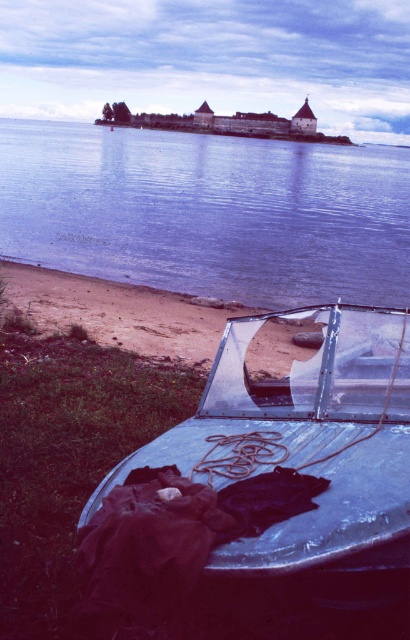
Question: Is blue water at center smaller than metallic blue boat at lower center?

Choices:
 (A) yes
 (B) no

Answer: (B)

Question: Does blue water at center have a greater width compared to metallic blue boat at lower center?

Choices:
 (A) yes
 (B) no

Answer: (A)

Question: Which point is farther from the camera taking this photo?

Choices:
 (A) (350, 512)
 (B) (289, 189)

Answer: (B)

Question: Which point appears farthest from the camera in this image?

Choices:
 (A) (166, 280)
 (B) (344, 515)

Answer: (A)

Question: Is blue water at center below metallic blue boat at lower center?

Choices:
 (A) no
 (B) yes

Answer: (A)

Question: Which of the following is the farthest from the observer?

Choices:
 (A) metallic blue boat at lower center
 (B) blue water at center

Answer: (B)